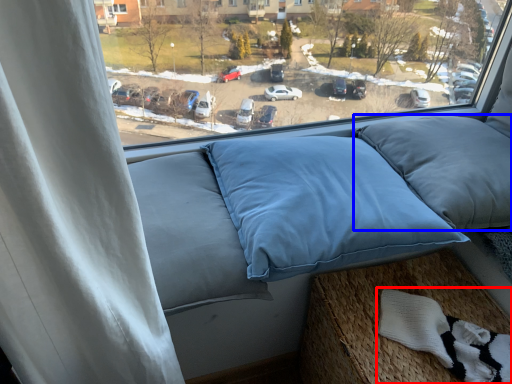
Question: Among these objects, which one is farthest to the camera, material (highlighted by a red box) or pillow (highlighted by a blue box)?

Choices:
 (A) material
 (B) pillow

Answer: (B)